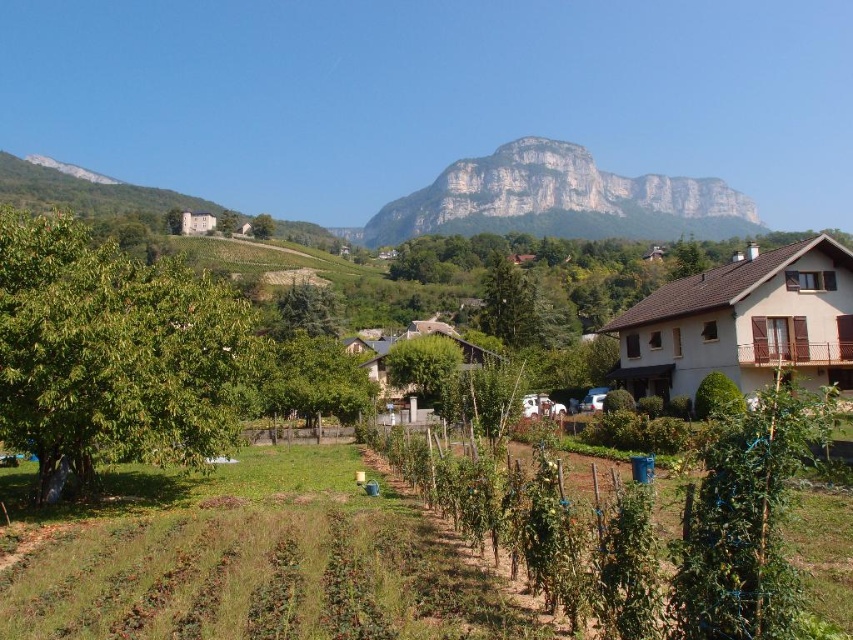
You are a hiker planning to take a photo of the rugged stone mountain at upper center and the green leafy tree at upper center from the garden. Which object should you focus on first if you want to capture both in one frame without moving the camera?

You should focus on the rugged stone mountain at upper center first because it is larger in size than the green leafy tree at upper center, so it will take up more space in the frame.